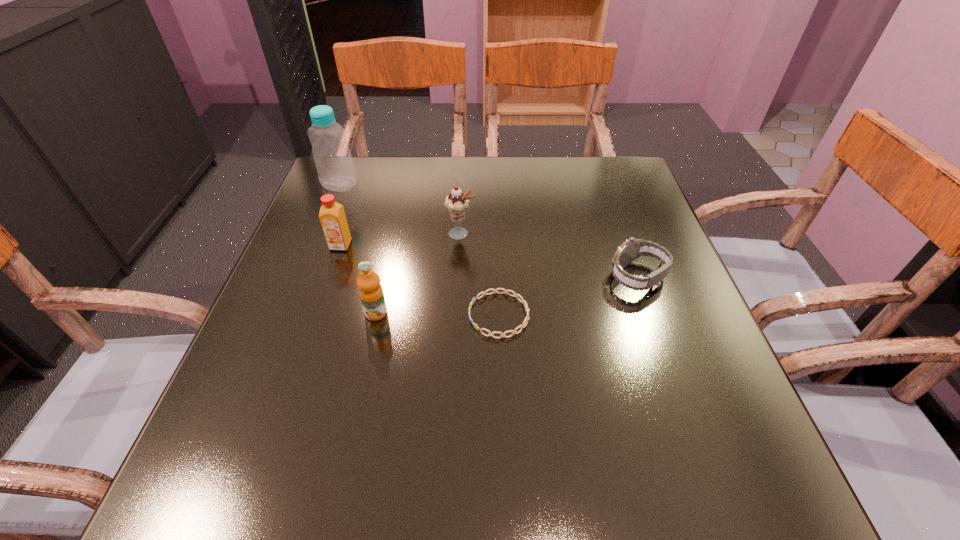
Select which object is the fourth closest to the tallest object. Please provide its 2D coordinates. Your answer should be formatted as a tuple, i.e. [(x, y)], where the tuple contains the x and y coordinates of a point satisfying the conditions above.

[(523, 301)]

The width and height of the screenshot is (960, 540). I want to click on object that is the fourth closest to the left orange juice, so click(x=523, y=301).